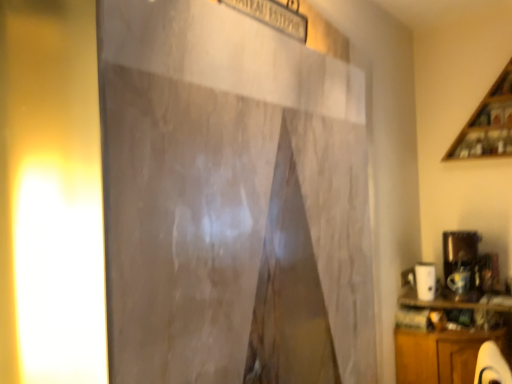
Question: Does wooden cabinet at lower right have a greater width compared to wooden at upper right?

Choices:
 (A) no
 (B) yes

Answer: (B)

Question: Is wooden cabinet at lower right not inside wooden at upper right?

Choices:
 (A) yes
 (B) no

Answer: (A)

Question: Is wooden cabinet at lower right to the right of wooden at upper right from the viewer's perspective?

Choices:
 (A) no
 (B) yes

Answer: (A)

Question: Is wooden cabinet at lower right surrounding wooden at upper right?

Choices:
 (A) yes
 (B) no

Answer: (B)

Question: Is wooden cabinet at lower right oriented away from wooden at upper right?

Choices:
 (A) yes
 (B) no

Answer: (B)

Question: Is yellow matte light at left bigger or smaller than wooden cabinet at lower right?

Choices:
 (A) small
 (B) big

Answer: (A)

Question: Is point (40, 304) closer or farther from the camera than point (460, 339)?

Choices:
 (A) closer
 (B) farther

Answer: (A)

Question: From the image's perspective, is yellow matte light at left positioned above or below wooden cabinet at lower right?

Choices:
 (A) below
 (B) above

Answer: (B)

Question: From a real-world perspective, relative to wooden cabinet at lower right, is yellow matte light at left vertically above or below?

Choices:
 (A) above
 (B) below

Answer: (A)

Question: In terms of height, does wooden cabinet at lower right look taller or shorter compared to yellow matte light at left?

Choices:
 (A) short
 (B) tall

Answer: (A)

Question: Relative to yellow matte light at left, is wooden cabinet at lower right in front or behind?

Choices:
 (A) front
 (B) behind

Answer: (B)

Question: Based on their sizes in the image, would you say wooden cabinet at lower right is bigger or smaller than yellow matte light at left?

Choices:
 (A) small
 (B) big

Answer: (B)

Question: Visually, is wooden cabinet at lower right positioned to the left or to the right of yellow matte light at left?

Choices:
 (A) left
 (B) right

Answer: (B)

Question: Considering their positions, is wooden cabinet at lower right located in front of or behind wooden at upper right?

Choices:
 (A) behind
 (B) front

Answer: (B)

Question: From a real-world perspective, is wooden cabinet at lower right physically located above or below wooden at upper right?

Choices:
 (A) below
 (B) above

Answer: (A)